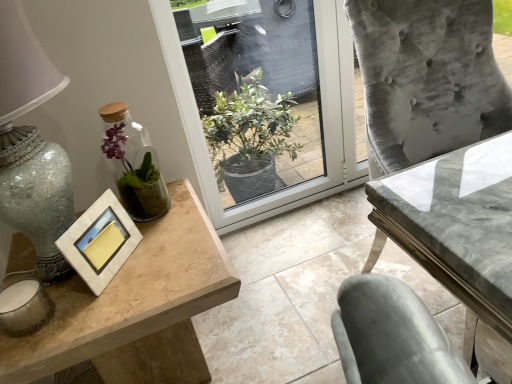
Question: Is there a large distance between transparent glass window at center and marble gray table at center, which is the second table in left-to-right order?

Choices:
 (A) yes
 (B) no

Answer: (A)

Question: Does transparent glass window at center have a smaller size compared to marble gray table at center, which ranks as the first table in right-to-left order?

Choices:
 (A) no
 (B) yes

Answer: (B)

Question: From the image's perspective, does transparent glass window at center appear lower than marble gray table at center, which ranks as the first table in right-to-left order?

Choices:
 (A) yes
 (B) no

Answer: (B)

Question: Could you tell me if transparent glass window at center is facing marble gray table at center, which is the second table in left-to-right order?

Choices:
 (A) yes
 (B) no

Answer: (A)

Question: Can you confirm if transparent glass window at center is taller than marble gray table at center, which ranks as the first table in right-to-left order?

Choices:
 (A) no
 (B) yes

Answer: (B)

Question: Can you confirm if transparent glass window at center is shorter than marble gray table at center, which ranks as the first table in right-to-left order?

Choices:
 (A) yes
 (B) no

Answer: (B)

Question: Is clear glass vase at left facing towards wooden table at left, marked as the second table in a right-to-left arrangement?

Choices:
 (A) yes
 (B) no

Answer: (B)

Question: Is clear glass vase at left to the right of wooden table at left, marked as the second table in a right-to-left arrangement, from the viewer's perspective?

Choices:
 (A) no
 (B) yes

Answer: (B)

Question: From a real-world perspective, does clear glass vase at left stand above wooden table at left, marked as the second table in a right-to-left arrangement?

Choices:
 (A) no
 (B) yes

Answer: (B)

Question: Can wooden table at left, marked as the second table in a right-to-left arrangement, be found inside clear glass vase at left?

Choices:
 (A) no
 (B) yes

Answer: (A)

Question: Considering the relative sizes of clear glass vase at left and wooden table at left, marked as the second table in a right-to-left arrangement, in the image provided, is clear glass vase at left taller than wooden table at left, marked as the second table in a right-to-left arrangement,?

Choices:
 (A) yes
 (B) no

Answer: (B)

Question: From the image's perspective, is clear glass vase at left located above wooden table at left, marked as the second table in a right-to-left arrangement?

Choices:
 (A) no
 (B) yes

Answer: (B)

Question: From the image's perspective, is transparent glass window at center beneath wooden table at left, marked as the second table in a right-to-left arrangement?

Choices:
 (A) yes
 (B) no

Answer: (B)